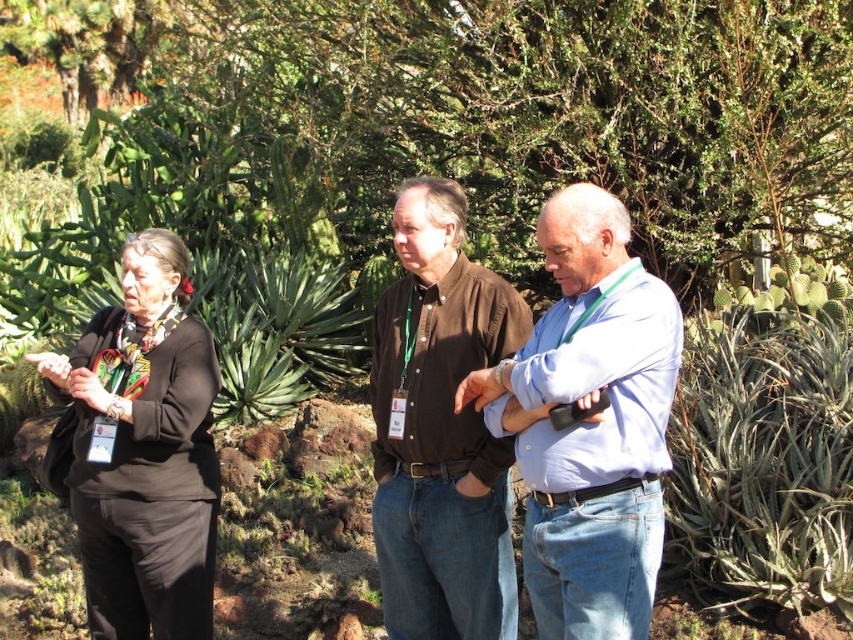
You are a photographer trying to capture a group photo of the light blue shirt at center and the black fabric at left. The camera you are using has a focus range that can only accommodate objects up to 1.5 meters in height. Given their heights, can you focus on both subjects simultaneously?

The light blue shirt at center is not as tall as black fabric at left. Since the black fabric at left is taller than the light blue shirt at center, and the focus range can handle up to 1.5 meters, you need to check if both heights are within this range. However, without specific height measurements, it is impossible to determine if both will fit within the camera focus range.

You are a tour guide in a botanical garden. You notice the green spiky plant at right and the black fabric at left. Which object is positioned to the right side of the other?

The green spiky plant at right is to the right of black fabric at left.

You are a photographer trying to capture a group photo of the light blue shirt at center and the brown cotton shirt at center. If you want to ensure both shirts are fully visible in the frame, which one should you focus on first, considering their widths?

The light blue shirt at center might be wider than brown cotton shirt at center, so you should focus on the light blue shirt at center first to ensure it fits within the frame.